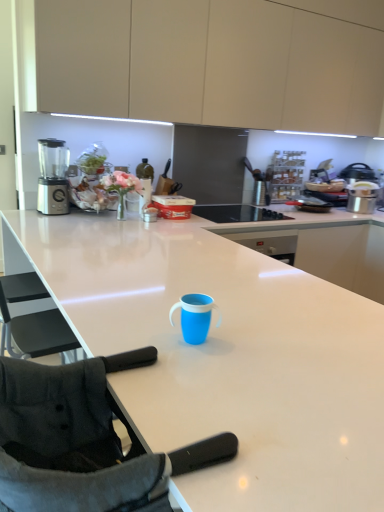
Where is `matte beige cabinets at upper center`? The height and width of the screenshot is (512, 384). matte beige cabinets at upper center is located at coordinates (212, 62).

This screenshot has width=384, height=512. Describe the element at coordinates (226, 357) in the screenshot. I see `white glossy countertop at center` at that location.

What is the approximate width of white glossy countertop at center?

white glossy countertop at center is 38.25 inches in width.

At what (x,y) coordinates should I click in order to perform the action: click on satin silver blender at left. Please return your answer as a coordinate pair (x, y). Looking at the image, I should click on pyautogui.click(x=53, y=177).

Is black fabric folding chair at lower left aimed at matte beige cabinets at upper center?

No, black fabric folding chair at lower left is not facing towards matte beige cabinets at upper center.

From the image's perspective, is black fabric folding chair at lower left above or below matte beige cabinets at upper center?

Clearly, from the image's perspective, black fabric folding chair at lower left is below matte beige cabinets at upper center.

From the picture: What's the angular difference between black fabric folding chair at lower left and matte beige cabinets at upper center's facing directions?

They differ by 90.1 degrees in their facing directions.

From a real-world perspective, is black fabric folding chair at lower left on matte beige cabinets at upper center?

No, from a real-world perspective, black fabric folding chair at lower left is not over matte beige cabinets at upper center

Consider the image. From the image's perspective, is matte beige cabinets at upper center on blue plastic sippy cup at center?

Indeed, from the image's perspective, matte beige cabinets at upper center is shown above blue plastic sippy cup at center.

Identify the location of tableware located below the matte beige cabinets at upper center (from the image's perspective). (194, 317).

Is matte beige cabinets at upper center positioned with its back to blue plastic sippy cup at center?

That's not correct — matte beige cabinets at upper center is not looking away from blue plastic sippy cup at center.

Would you say matte beige cabinets at upper center is outside blue plastic sippy cup at center?

Yes, matte beige cabinets at upper center is outside of blue plastic sippy cup at center.

Which object is wider, black fabric folding chair at lower left or satin silver blender at left?

Wider between the two is black fabric folding chair at lower left.

Can we say black fabric folding chair at lower left lies outside satin silver blender at left?

Absolutely, black fabric folding chair at lower left is external to satin silver blender at left.

Can you confirm if black fabric folding chair at lower left is bigger than satin silver blender at left?

Yes, black fabric folding chair at lower left is bigger than satin silver blender at left.

Could you tell me if black fabric folding chair at lower left is turned towards satin silver blender at left?

No, black fabric folding chair at lower left is not aimed at satin silver blender at left.

Would you say blue plastic sippy cup at center is a long distance from white glossy countertop at center?

They are positioned close to each other.

Considering the relative sizes of blue plastic sippy cup at center and white glossy countertop at center in the image provided, is blue plastic sippy cup at center bigger than white glossy countertop at center?

Actually, blue plastic sippy cup at center might be smaller than white glossy countertop at center.

Where is `countertop on the left side of blue plastic sippy cup at center`? The height and width of the screenshot is (512, 384). countertop on the left side of blue plastic sippy cup at center is located at coordinates (226, 357).

Is blue plastic sippy cup at center spatially inside white glossy countertop at center, or outside of it?

blue plastic sippy cup at center cannot be found inside white glossy countertop at center.

Which is in front, point (58, 17) or point (217, 454)?

The point (217, 454) is closer to the camera.

Which of these two, matte beige cabinets at upper center or black fabric folding chair at lower left, is thinner?

black fabric folding chair at lower left is thinner.

From the image's perspective, which is above, matte beige cabinets at upper center or black fabric folding chair at lower left?

matte beige cabinets at upper center appears higher in the image.

From a real-world perspective, which is physically above, matte beige cabinets at upper center or black fabric folding chair at lower left?

In real-world perspective, matte beige cabinets at upper center is above.

From a real-world perspective, which object rests below the other?

satin silver blender at left.

Is matte beige cabinets at upper center in contact with satin silver blender at left?

No, matte beige cabinets at upper center is not with satin silver blender at left.

From the picture: Is matte beige cabinets at upper center to the left of satin silver blender at left from the viewer's perspective?

No, matte beige cabinets at upper center is not to the left of satin silver blender at left.

Considering the relative sizes of matte beige cabinets at upper center and satin silver blender at left in the image provided, is matte beige cabinets at upper center wider than satin silver blender at left?

Correct, the width of matte beige cabinets at upper center exceeds that of satin silver blender at left.

From a real-world perspective, which is physically above, satin silver blender at left or matte beige cabinets at upper center?

From a 3D spatial view, matte beige cabinets at upper center is above.

Considering the sizes of satin silver blender at left and matte beige cabinets at upper center in the image, is satin silver blender at left taller or shorter than matte beige cabinets at upper center?

Considering their sizes, satin silver blender at left has less height than matte beige cabinets at upper center.

I want to click on cabinetry in front of the satin silver blender at left, so click(212, 62).

Is point (48, 187) less distant than point (210, 7)?

No, (48, 187) is further to viewer.

Where is `folding chair that appears in front of the matte beige cabinets at upper center`? The height and width of the screenshot is (512, 384). folding chair that appears in front of the matte beige cabinets at upper center is located at coordinates (80, 443).

Locate an element on the screen. cabinetry above the blue plastic sippy cup at center (from a real-world perspective) is located at coordinates (212, 62).

From the image, which object appears to be farther from white glossy countertop at center, blue plastic sippy cup at center or satin silver blender at left?

satin silver blender at left is further to white glossy countertop at center.

Estimate the real-world distances between objects in this image. Which object is further from satin silver blender at left, black glass cooktop at center or white glossy countertop at center?

white glossy countertop at center lies further to satin silver blender at left than the other object.

When comparing their distances from white glossy countertop at center, does matte beige cabinets at upper center or blue plastic sippy cup at center seem closer?

blue plastic sippy cup at center lies closer to white glossy countertop at center than the other object.

In the scene shown: Based on their spatial positions, is matte beige cabinets at upper center or satin silver blender at left further from black glass cooktop at center?

satin silver blender at left is further to black glass cooktop at center.

In the scene shown: Which object lies nearer to the anchor point blue plastic sippy cup at center, matte beige cabinets at upper center or black fabric folding chair at lower left?

black fabric folding chair at lower left.

Based on their spatial positions, is satin silver blender at left or blue plastic sippy cup at center closer to white glossy countertop at center?

Based on the image, blue plastic sippy cup at center appears to be nearer to white glossy countertop at center.

Based on their spatial positions, is black fabric folding chair at lower left or white glossy countertop at center closer to matte beige cabinets at upper center?

white glossy countertop at center.

Estimate the real-world distances between objects in this image. Which object is further from satin silver blender at left, blue plastic sippy cup at center or matte beige cabinets at upper center?

The object further to satin silver blender at left is blue plastic sippy cup at center.

The height and width of the screenshot is (512, 384). I want to click on blender between black fabric folding chair at lower left and black glass cooktop at center along the z-axis, so coord(53,177).

Where is `tableware between white glossy countertop at center and satin silver blender at left from front to back`? Image resolution: width=384 pixels, height=512 pixels. tableware between white glossy countertop at center and satin silver blender at left from front to back is located at coordinates (194, 317).

The image size is (384, 512). What are the coordinates of `blender positioned between blue plastic sippy cup at center and black glass cooktop at center from near to far` in the screenshot? It's located at (53, 177).

What are the coordinates of `tableware between matte beige cabinets at upper center and black fabric folding chair at lower left in the up-down direction` in the screenshot? It's located at (194, 317).